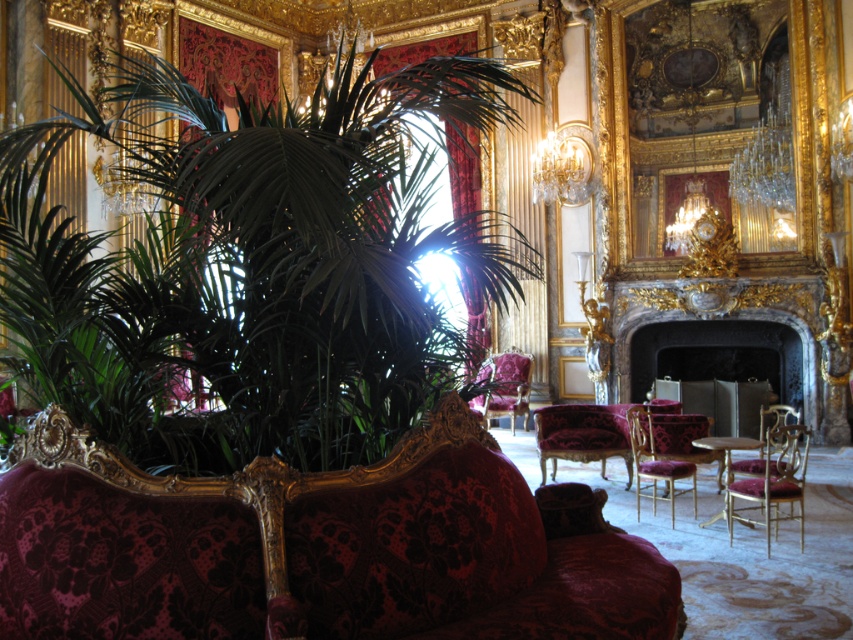
You are an interior designer assessing the layout of the room. Given the dark gray stone fireplace at center is positioned at coordinates 0.517 on the x axis and 0.843 on the y axis, how does its placement affect the room symmetry?

The dark gray stone fireplace at center is located at point (718, 330), which places it near the center of the room, contributing to a balanced and symmetrical layout.

You are standing in the opulent room and want to reach a specific point marked at coordinates point [639,390]. If your walking speed is 3 feet per second, how many seconds will it take you to reach that point?

The point [639,390] is 42.99 feet away from the viewer. At a speed of 3 feet per second, it would take approximately 14.33 seconds to reach the point.

You are standing in the luxurious room and want to reach the two points marked in the image. Which point, point (662, 291) or point (531, 356), is closer to you?

Point (662, 291) is closer to the viewer than point (531, 356).